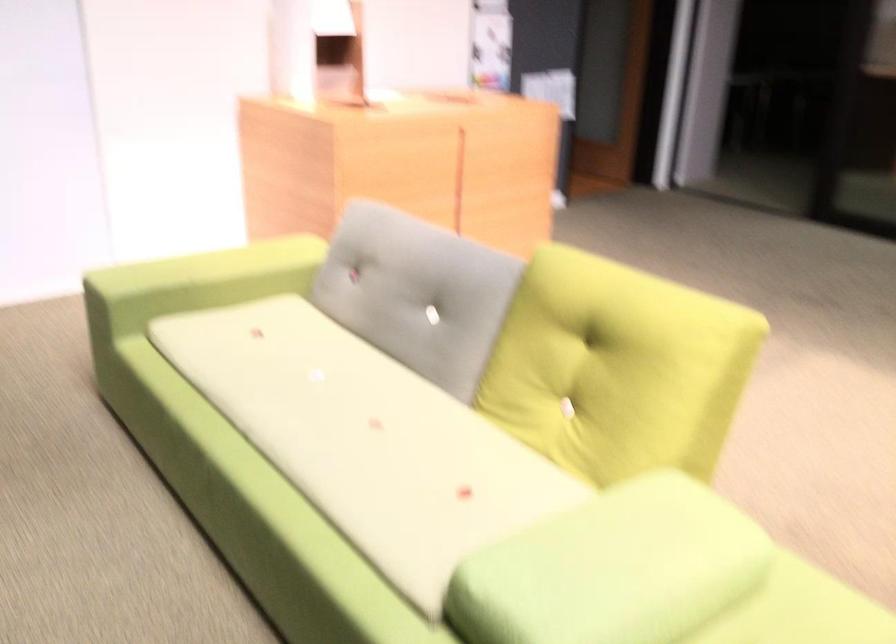
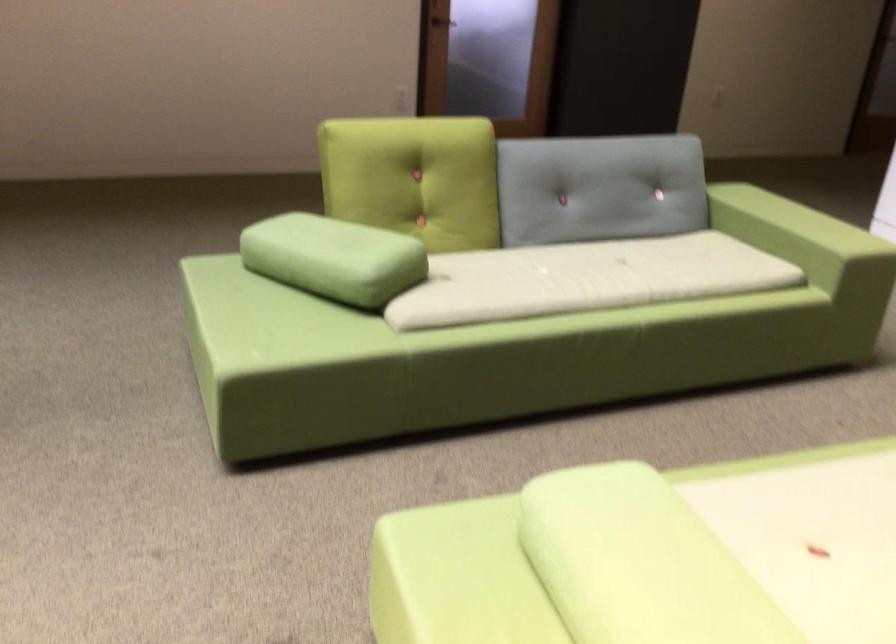
The point at (625, 542) is marked in the first image. Where is the corresponding point in the second image?

(651, 556)